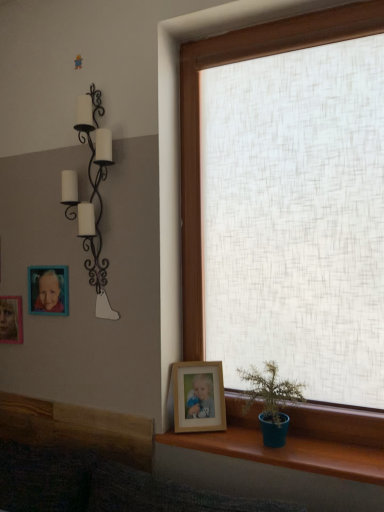
Question: Is matte plastic picture frame at upper left, which appears as the first picture frame when viewed from the top, situated inside teak wood window sill at lower right or outside?

Choices:
 (A) outside
 (B) inside

Answer: (A)

Question: Is point (39, 268) positioned closer to the camera than point (349, 426)?

Choices:
 (A) closer
 (B) farther

Answer: (B)

Question: Which of these objects is positioned farthest from the wooden photo frame at lower center, placed as the 1th picture frame when sorted from bottom to top?

Choices:
 (A) black wrought iron candle holder at upper left
 (B) teal ceramic pot at lower right
 (C) matte plastic picture frame at upper left, which appears as the first picture frame when viewed from the top
 (D) teak wood window sill at lower right
 (E) wooden photo frame at left, which ranks as the second picture frame in bottom-to-top order

Answer: (E)

Question: Based on their relative distances, which object is nearer to the teal ceramic pot at lower right?

Choices:
 (A) matte plastic picture frame at upper left, the second picture frame from the back
 (B) wooden photo frame at left, positioned as the second picture frame in top-to-bottom order
 (C) wooden photo frame at lower center, which ranks as the third picture frame in top-to-bottom order
 (D) teak wood window sill at lower right
 (E) black wrought iron candle holder at upper left

Answer: (D)